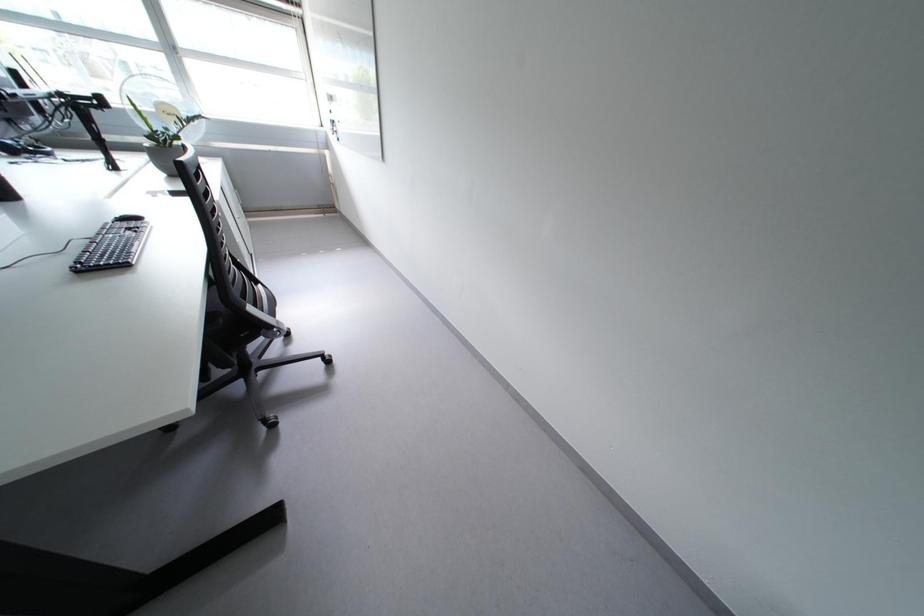
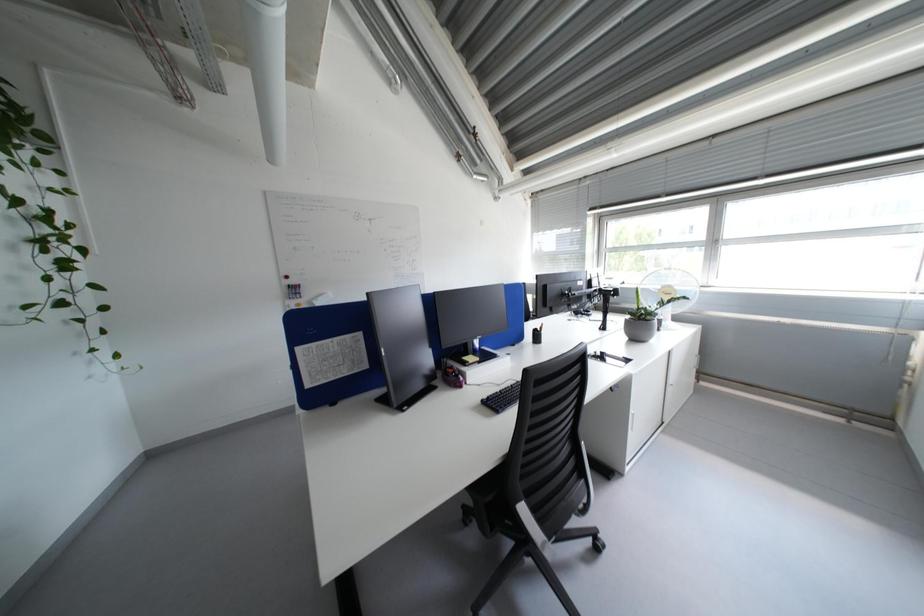
Question: The images are taken continuously from a first-person perspective. In which direction is your viewpoint rotating?

Choices:
 (A) Left
 (B) Right
 (C) Up
 (D) Down

Answer: (A)